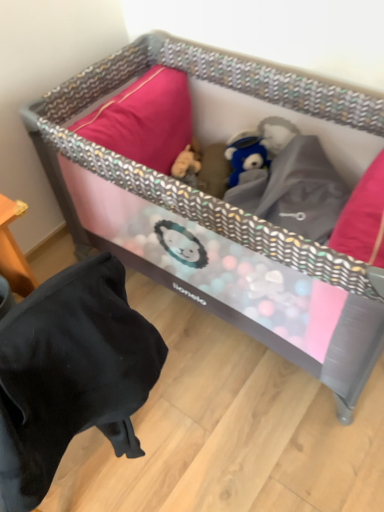
Question: Can we say black fabric bean bag chair at lower left lies outside pink fabric playpen at center?

Choices:
 (A) yes
 (B) no

Answer: (A)

Question: Considering the relative sizes of black fabric bean bag chair at lower left and pink fabric playpen at center in the image provided, is black fabric bean bag chair at lower left taller than pink fabric playpen at center?

Choices:
 (A) yes
 (B) no

Answer: (A)

Question: Can you confirm if black fabric bean bag chair at lower left is shorter than pink fabric playpen at center?

Choices:
 (A) no
 (B) yes

Answer: (A)

Question: Is black fabric bean bag chair at lower left thinner than pink fabric playpen at center?

Choices:
 (A) yes
 (B) no

Answer: (A)

Question: Is pink fabric playpen at center at the back of black fabric bean bag chair at lower left?

Choices:
 (A) no
 (B) yes

Answer: (A)

Question: Considering their positions, is pink fabric playpen at center located in front of or behind black fabric bean bag chair at lower left?

Choices:
 (A) behind
 (B) front

Answer: (A)

Question: From the image's perspective, relative to black fabric bean bag chair at lower left, is pink fabric playpen at center above or below?

Choices:
 (A) above
 (B) below

Answer: (A)

Question: Is pink fabric playpen at center bigger or smaller than black fabric bean bag chair at lower left?

Choices:
 (A) small
 (B) big

Answer: (B)

Question: Visually, is pink fabric playpen at center positioned to the left or to the right of black fabric bean bag chair at lower left?

Choices:
 (A) left
 (B) right

Answer: (B)

Question: Based on their positions, is pink fabric playpen at center located to the left or right of fuzzy brown stuffed animal at center?

Choices:
 (A) right
 (B) left

Answer: (A)

Question: Considering their positions, is pink fabric playpen at center located in front of or behind fuzzy brown stuffed animal at center?

Choices:
 (A) behind
 (B) front

Answer: (B)

Question: Is pink fabric playpen at center spatially inside fuzzy brown stuffed animal at center, or outside of it?

Choices:
 (A) inside
 (B) outside

Answer: (B)

Question: Looking at their shapes, would you say pink fabric playpen at center is wider or thinner than fuzzy brown stuffed animal at center?

Choices:
 (A) wide
 (B) thin

Answer: (A)

Question: Considering their positions, is fuzzy brown stuffed animal at center located in front of or behind pink fabric playpen at center?

Choices:
 (A) behind
 (B) front

Answer: (A)

Question: From a real-world perspective, is fuzzy brown stuffed animal at center physically located above or below pink fabric playpen at center?

Choices:
 (A) above
 (B) below

Answer: (B)